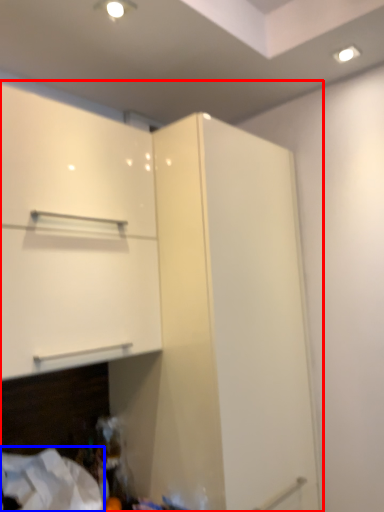
Question: Which object is further to the camera taking this photo, cupboard (highlighted by a red box) or sheet (highlighted by a blue box)?

Choices:
 (A) cupboard
 (B) sheet

Answer: (B)